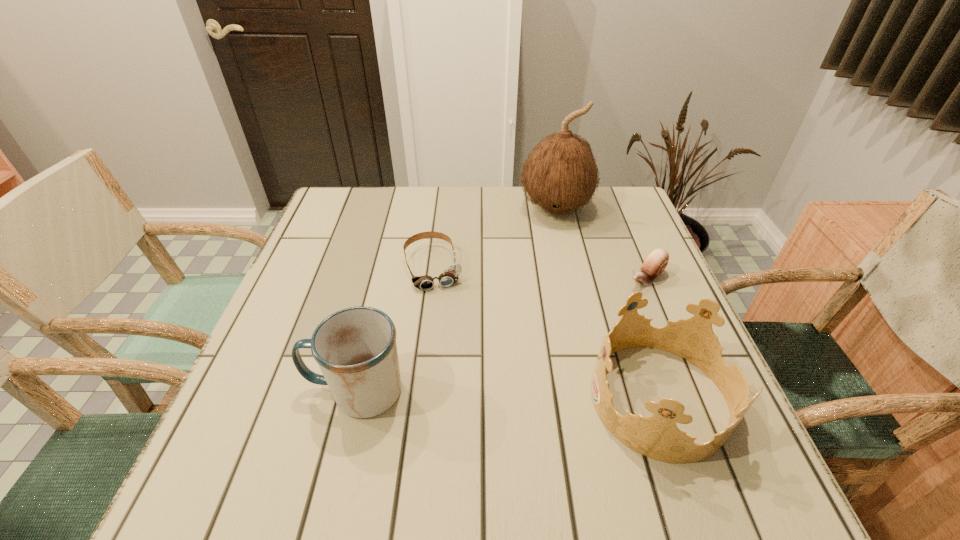
What are the coordinates of `vacant space on the desktop that is between the mug and the tiara and is positioned on the front-facing side of the goggles` in the screenshot? It's located at (467, 394).

Identify the location of vacant space on the desktop that is between the mug and the tiara and is positioned on the surface of the coconut. (552, 396).

Locate an element on the screen. This screenshot has height=540, width=960. vacant spot on the desktop that is between the mug and the tiara and is positioned on the front-facing side of the escargot is located at coordinates (482, 394).